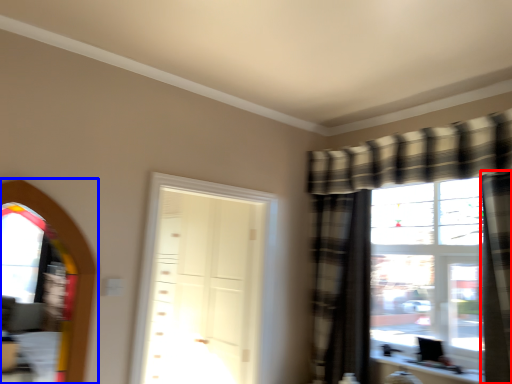
Question: Which point is further to the camera, curtain (highlighted by a red box) or window screen (highlighted by a blue box)?

Choices:
 (A) curtain
 (B) window screen

Answer: (A)